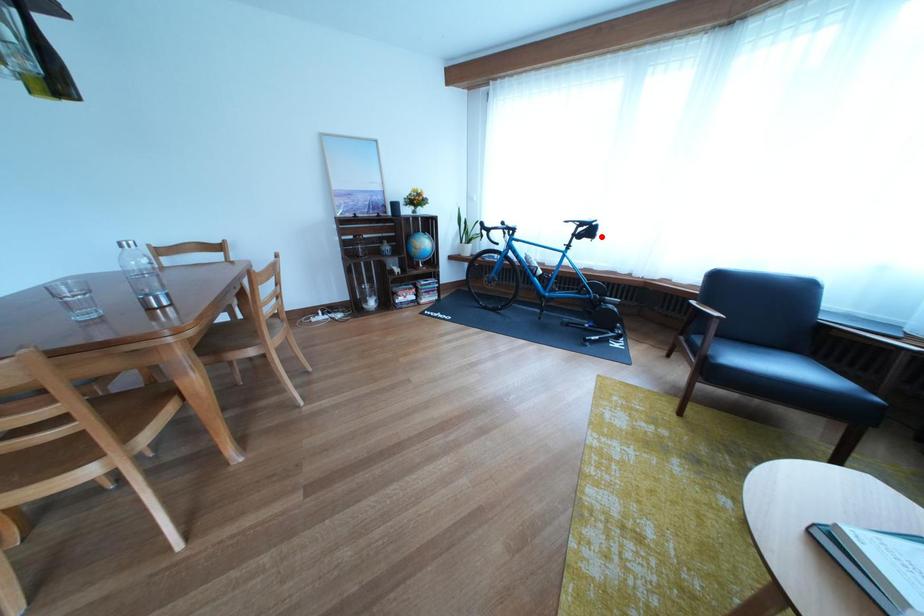
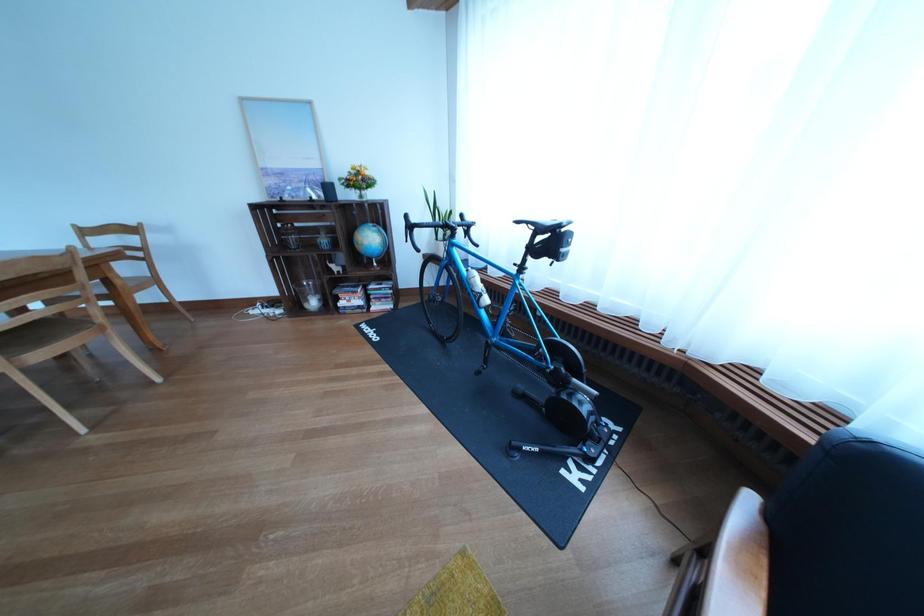
Where in the second image is the point corresponding to the highlighted location from the first image?

(563, 248)